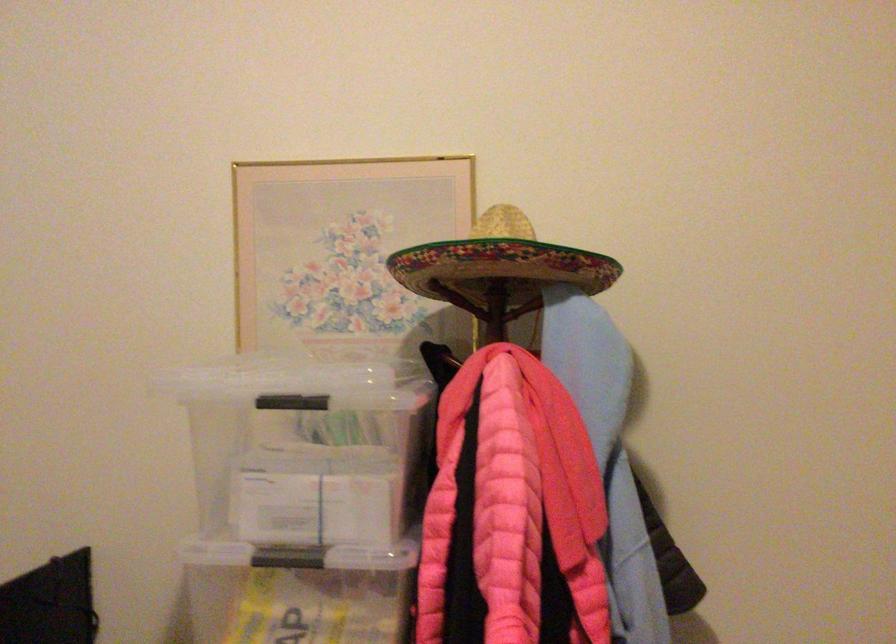
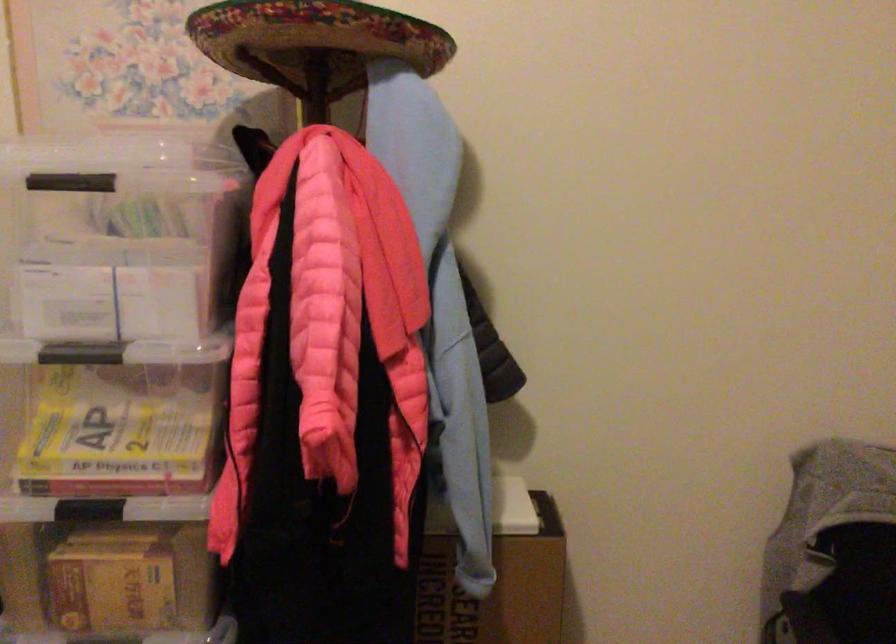
Which direction would the cameraman need to move to produce the second image?

The cameraman walked toward right, forward.